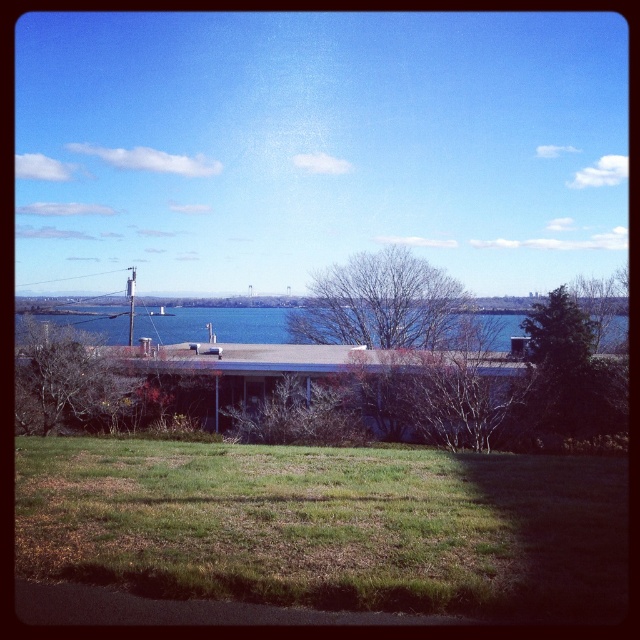
Who is positioned more to the left, green grassy field at lower center or blue water at center?

blue water at center is more to the left.

Does green grassy field at lower center appear on the left side of blue water at center?

Incorrect, green grassy field at lower center is not on the left side of blue water at center.

I want to click on green grassy field at lower center, so click(x=328, y=525).

Where is `green grassy field at lower center`? Image resolution: width=640 pixels, height=640 pixels. green grassy field at lower center is located at coordinates (328, 525).

Between green leafy tree at center and green leafy tree at upper right, which one has less height?

green leafy tree at center is shorter.

Describe the element at coordinates (67, 380) in the screenshot. I see `green leafy tree at center` at that location.

Who is more forward, (58, 385) or (564, 337)?

Positioned in front is point (58, 385).

The width and height of the screenshot is (640, 640). What are the coordinates of `green leafy tree at center` in the screenshot? It's located at (67, 380).

Does point (378, 557) lie behind point (557, 314)?

No, it is not.

Is green grassy field at lower center wider than green leafy tree at upper right?

Incorrect, green grassy field at lower center's width does not surpass green leafy tree at upper right's.

Find the location of a particular element. This screenshot has height=640, width=640. green grassy field at lower center is located at coordinates (328, 525).

Identify the location of green grassy field at lower center. (328, 525).